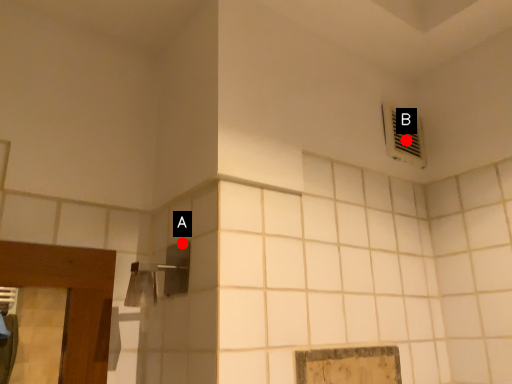
Question: Two points are circled on the image, labeled by A and B beside each circle. Among these points, which one is farthest from the camera?

Choices:
 (A) A is further
 (B) B is further

Answer: (B)